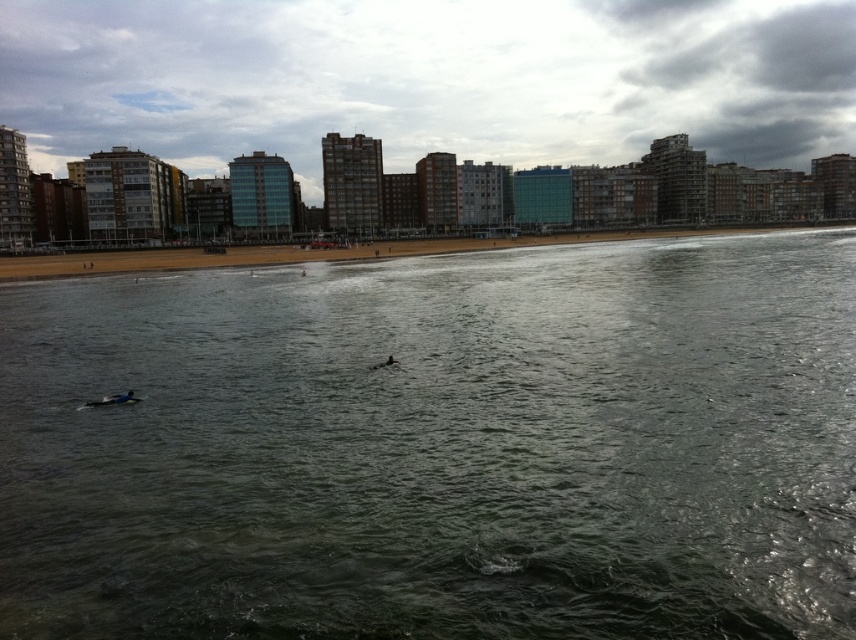
You are a lifeguard standing on the beach and need to quickly assess the scene. Which area covers more ground, the dark green water at center or the brown sand at lower center?

The brown sand at lower center covers more ground since the dark green water at center has a smaller size compared to it.

You are a photographer trying to capture the brown sand at lower center and the dark green water at center in a single shot. Based on their positions, which one will appear closer to the bottom edge of your photo?

The brown sand at lower center is positioned above the dark green water at center, so the dark green water at center will appear closer to the bottom edge of the photo.

Based on the photo, you are a lifeguard on duty and need to assess the distance between the dark green water at center and the brown sand at lower center. Which of the two is narrower in width?

The dark green water at center is thinner than brown sand at lower center, so the dark green water at center is narrower in width.